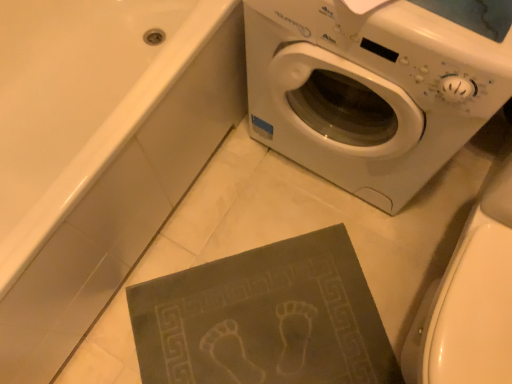
Question: Does matte gray bath mat at lower center have a lesser height compared to white plastic washing machine at upper right?

Choices:
 (A) yes
 (B) no

Answer: (A)

Question: Does matte gray bath mat at lower center come behind white plastic washing machine at upper right?

Choices:
 (A) yes
 (B) no

Answer: (B)

Question: From a real-world perspective, is matte gray bath mat at lower center positioned under white plastic washing machine at upper right based on gravity?

Choices:
 (A) no
 (B) yes

Answer: (B)

Question: Is matte gray bath mat at lower center at the left side of white plastic washing machine at upper right?

Choices:
 (A) yes
 (B) no

Answer: (A)

Question: Is matte gray bath mat at lower center far from white plastic washing machine at upper right?

Choices:
 (A) no
 (B) yes

Answer: (A)

Question: From a real-world perspective, is white plastic washing machine at upper right physically located above or below matte gray bath mat at lower center?

Choices:
 (A) below
 (B) above

Answer: (B)

Question: From the image's perspective, relative to matte gray bath mat at lower center, is white plastic washing machine at upper right above or below?

Choices:
 (A) above
 (B) below

Answer: (A)

Question: In terms of size, does white plastic washing machine at upper right appear bigger or smaller than matte gray bath mat at lower center?

Choices:
 (A) big
 (B) small

Answer: (B)

Question: Based on their positions, is white plastic washing machine at upper right located to the left or right of matte gray bath mat at lower center?

Choices:
 (A) right
 (B) left

Answer: (A)

Question: From the image's perspective, is matte gray bath mat at lower center positioned above or below white glossy toilet bowl at lower right?

Choices:
 (A) above
 (B) below

Answer: (A)

Question: Choose the correct answer: Is matte gray bath mat at lower center inside white glossy toilet bowl at lower right or outside it?

Choices:
 (A) inside
 (B) outside

Answer: (B)

Question: Is point (237, 62) closer or farther from the camera than point (490, 372)?

Choices:
 (A) closer
 (B) farther

Answer: (B)

Question: From a real-world perspective, is matte gray bath mat at lower center above or below white glossy toilet bowl at lower right?

Choices:
 (A) below
 (B) above

Answer: (A)

Question: From their relative heights in the image, would you say white glossy toilet bowl at lower right is taller or shorter than dark gray textured mat at lower center?

Choices:
 (A) short
 (B) tall

Answer: (B)

Question: From a real-world perspective, is white glossy toilet bowl at lower right positioned above or below dark gray textured mat at lower center?

Choices:
 (A) below
 (B) above

Answer: (B)